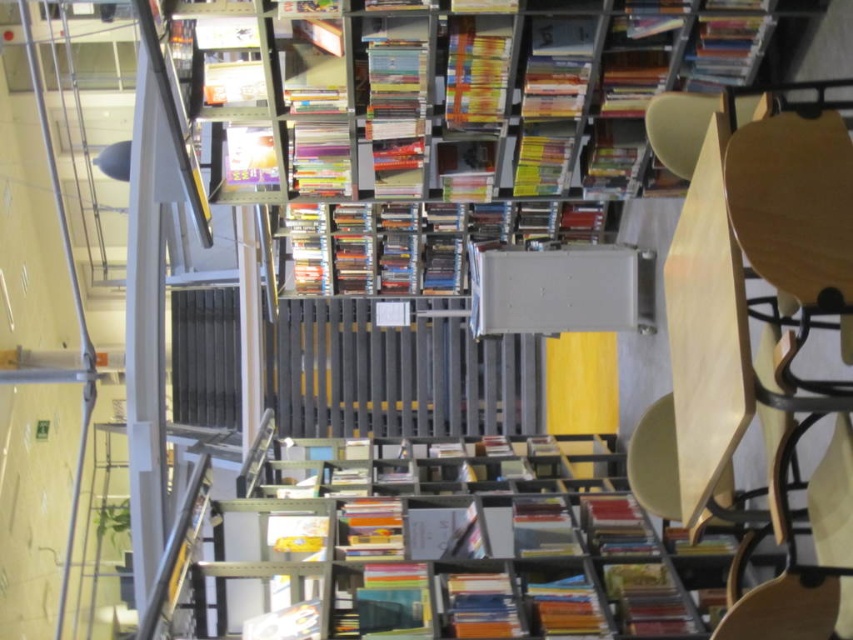
Is wooden chair at right wider than orange matte book at center?

Indeed, wooden chair at right has a greater width compared to orange matte book at center.

Does wooden chair at right come behind orange matte book at center?

That is False.

You are a GUI agent. You are given a task and a screenshot of the screen. Output one action in this format:
    pyautogui.click(x=<x>, y=<y>)
    Task: Click on the wooden chair at right
    
    Given the screenshot: What is the action you would take?
    tap(793, 204)

Does point (804, 288) lie in front of point (209, 86)?

Yes, point (804, 288) is closer to viewer.

How distant is wooden chair at right from white paper at upper center?

2.42 meters

Describe the element at coordinates (793, 204) in the screenshot. The height and width of the screenshot is (640, 853). I see `wooden chair at right` at that location.

This screenshot has width=853, height=640. What are the coordinates of `wooden chair at right` in the screenshot? It's located at (793, 204).

Can you confirm if orange matte book at center is positioned above white paper at upper center?

No, orange matte book at center is not above white paper at upper center.

Can you confirm if orange matte book at center is positioned below white paper at upper center?

Yes, orange matte book at center is below white paper at upper center.

Identify the location of orange matte book at center. This screenshot has height=640, width=853. (480, 605).